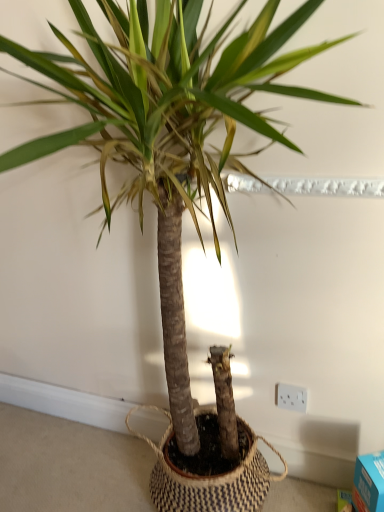
Question: Could white plastic electric outlet at lower right be considered to be inside blue cardboard box at lower right?

Choices:
 (A) yes
 (B) no

Answer: (B)

Question: Considering the relative positions of blue cardboard box at lower right and white plastic electric outlet at lower right in the image provided, is blue cardboard box at lower right behind white plastic electric outlet at lower right?

Choices:
 (A) no
 (B) yes

Answer: (A)

Question: Is blue cardboard box at lower right outside of white plastic electric outlet at lower right?

Choices:
 (A) no
 (B) yes

Answer: (B)

Question: Is blue cardboard box at lower right aimed at white plastic electric outlet at lower right?

Choices:
 (A) no
 (B) yes

Answer: (A)

Question: From a real-world perspective, is blue cardboard box at lower right physically below white plastic electric outlet at lower right?

Choices:
 (A) yes
 (B) no

Answer: (A)

Question: Is blue cardboard box at lower right closer to the viewer compared to white plastic electric outlet at lower right?

Choices:
 (A) yes
 (B) no

Answer: (A)

Question: Is white plastic electric outlet at lower right in front of blue cardboard box at lower right?

Choices:
 (A) yes
 (B) no

Answer: (B)

Question: From a real-world perspective, does white plastic electric outlet at lower right sit lower than blue cardboard box at lower right?

Choices:
 (A) no
 (B) yes

Answer: (A)

Question: Is white plastic electric outlet at lower right bigger than blue cardboard box at lower right?

Choices:
 (A) yes
 (B) no

Answer: (B)

Question: From the image's perspective, does white plastic electric outlet at lower right appear higher than blue cardboard box at lower right?

Choices:
 (A) yes
 (B) no

Answer: (A)

Question: Does white plastic electric outlet at lower right have a greater height compared to blue cardboard box at lower right?

Choices:
 (A) no
 (B) yes

Answer: (A)

Question: Considering the relative sizes of white plastic electric outlet at lower right and blue cardboard box at lower right in the image provided, is white plastic electric outlet at lower right smaller than blue cardboard box at lower right?

Choices:
 (A) no
 (B) yes

Answer: (B)

Question: In terms of size, does white plastic electric outlet at lower right appear bigger or smaller than blue cardboard box at lower right?

Choices:
 (A) small
 (B) big

Answer: (A)